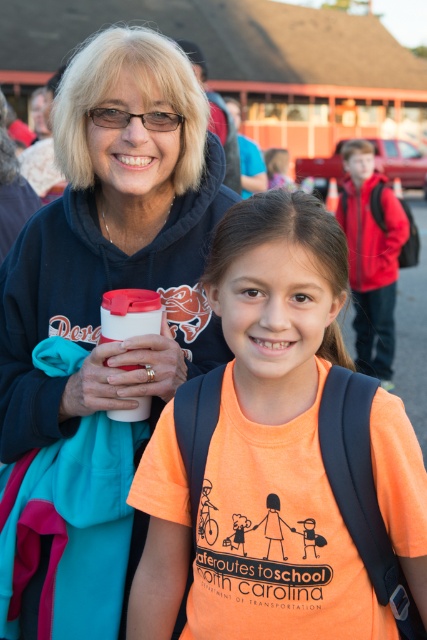
You are organizing a charity clothing drive and need to pack these items into boxes. The orange cotton shirt at center and the matte black hoodie at upper left must be packed together. Which item will require more space in the box?

The matte black hoodie at upper left requires more space in the box because it occupies more space than the orange cotton shirt at center.